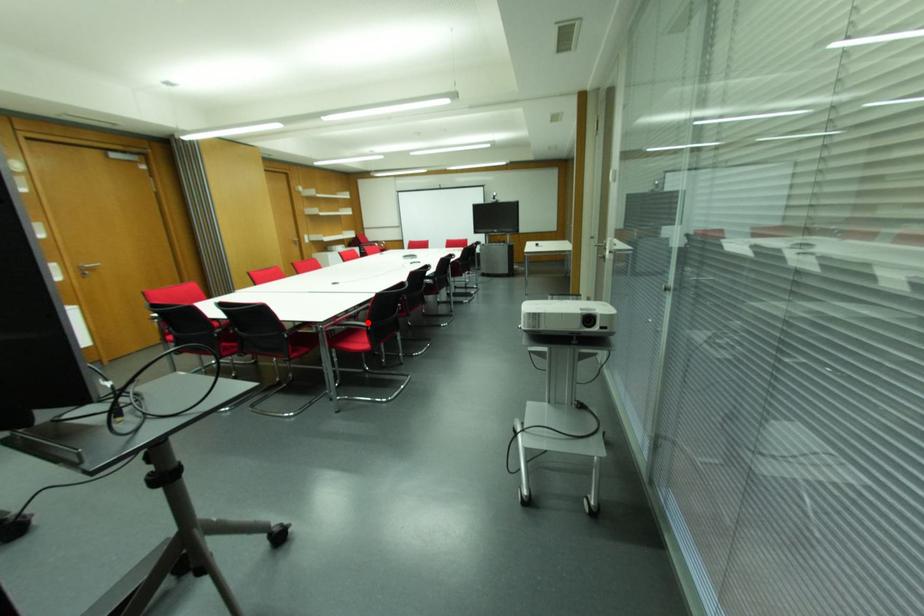
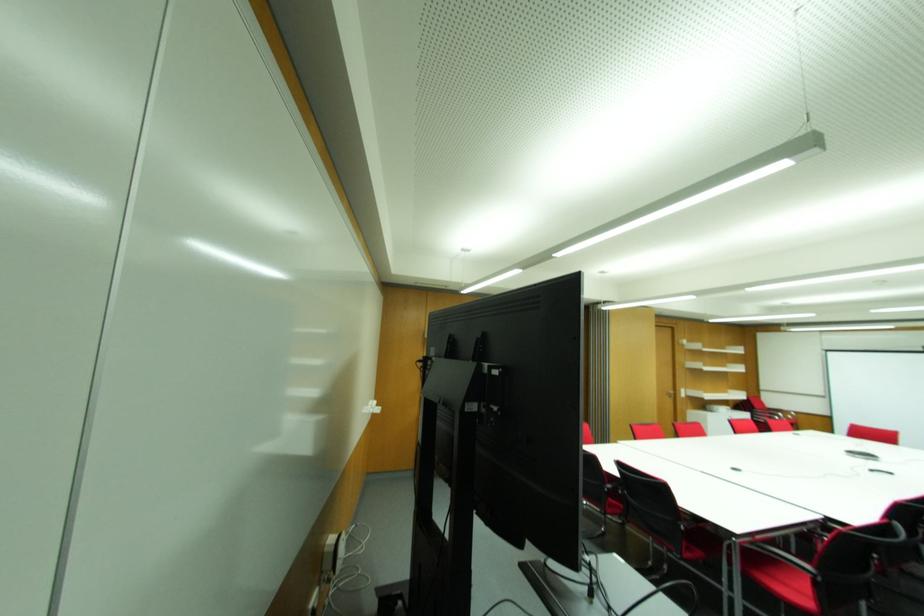
Find the pixel in the second image that matches the highlighted location in the first image.

(816, 569)